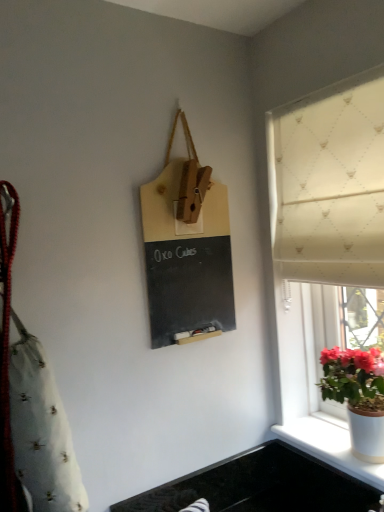
Question: Is black granite sink at lower center positioned beyond the bounds of white glossy pot at window?

Choices:
 (A) no
 (B) yes

Answer: (B)

Question: Does black granite sink at lower center contain white glossy pot at window?

Choices:
 (A) no
 (B) yes

Answer: (A)

Question: From the image's perspective, is black granite sink at lower center above white glossy pot at window?

Choices:
 (A) no
 (B) yes

Answer: (A)

Question: Does black granite sink at lower center appear on the right side of white glossy pot at window?

Choices:
 (A) yes
 (B) no

Answer: (B)

Question: Considering the relative positions of black granite sink at lower center and white glossy pot at window in the image provided, is black granite sink at lower center in front of white glossy pot at window?

Choices:
 (A) yes
 (B) no

Answer: (B)

Question: Can you confirm if black granite sink at lower center is bigger than white glossy pot at window?

Choices:
 (A) no
 (B) yes

Answer: (A)

Question: Is the surface of matte wood chalkboard at center in direct contact with black granite sink at lower center?

Choices:
 (A) no
 (B) yes

Answer: (A)

Question: Does matte wood chalkboard at center have a smaller size compared to black granite sink at lower center?

Choices:
 (A) no
 (B) yes

Answer: (A)

Question: Considering the relative sizes of matte wood chalkboard at center and black granite sink at lower center in the image provided, is matte wood chalkboard at center wider than black granite sink at lower center?

Choices:
 (A) yes
 (B) no

Answer: (B)

Question: Is black granite sink at lower center at the back of matte wood chalkboard at center?

Choices:
 (A) no
 (B) yes

Answer: (A)

Question: From a real-world perspective, is matte wood chalkboard at center positioned over black granite sink at lower center based on gravity?

Choices:
 (A) yes
 (B) no

Answer: (A)

Question: Considering the relative sizes of matte wood chalkboard at center and black granite sink at lower center in the image provided, is matte wood chalkboard at center shorter than black granite sink at lower center?

Choices:
 (A) yes
 (B) no

Answer: (B)

Question: Can you see white ceramic pot at lower right touching white glossy pot at window?

Choices:
 (A) no
 (B) yes

Answer: (A)